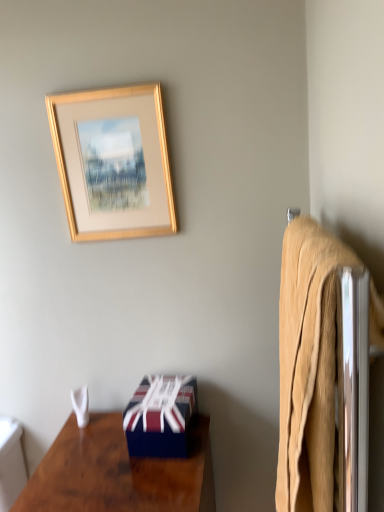
Question: Choose the correct answer: Is beige cotton bath towel at right inside gold wooden picture frame at upper center or outside it?

Choices:
 (A) outside
 (B) inside

Answer: (A)

Question: Is point (302, 506) positioned closer to the camera than point (134, 212)?

Choices:
 (A) closer
 (B) farther

Answer: (A)

Question: Based on their relative distances, which object is nearer to the beige cotton bath towel at right?

Choices:
 (A) blue glossy box at lower center
 (B) white fabric towel at lower left
 (C) gold wooden picture frame at upper center
 (D) shiny dark wood desk at lower left

Answer: (A)

Question: Based on their relative distances, which object is farther from the gold wooden picture frame at upper center?

Choices:
 (A) blue glossy box at lower center
 (B) beige cotton bath towel at right
 (C) shiny dark wood desk at lower left
 (D) white fabric towel at lower left

Answer: (D)